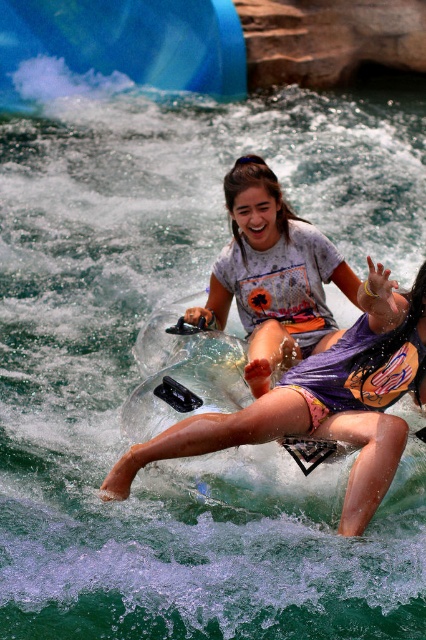
Question: Which of the following is the farthest from the observer?

Choices:
 (A) blue rubber slide at upper left
 (B) matte purple shorts at center

Answer: (A)

Question: Which of the following is the closest to the observer?

Choices:
 (A) blue rubber slide at upper left
 (B) matte purple shorts at center

Answer: (B)

Question: Which object is positioned closest to the matte purple shorts at center?

Choices:
 (A) blue rubber slide at upper left
 (B) matte gray t-shirt at center

Answer: (B)

Question: Does matte gray t-shirt at center come in front of blue rubber slide at upper left?

Choices:
 (A) yes
 (B) no

Answer: (A)

Question: Is matte gray t-shirt at center closer to camera compared to blue rubber slide at upper left?

Choices:
 (A) no
 (B) yes

Answer: (B)

Question: In this image, where is matte purple shorts at center located relative to matte gray t-shirt at center?

Choices:
 (A) below
 (B) above

Answer: (A)